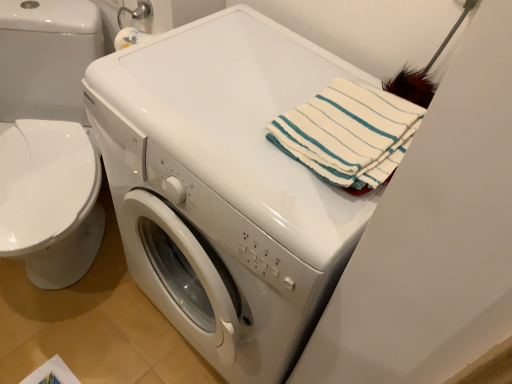
Question: Is white glossy washing machine at center positioned behind white striped towel at upper right?

Choices:
 (A) no
 (B) yes

Answer: (A)

Question: From a real-world perspective, is white glossy washing machine at center positioned under white striped towel at upper right based on gravity?

Choices:
 (A) no
 (B) yes

Answer: (B)

Question: Is white glossy washing machine at center at the left side of white striped towel at upper right?

Choices:
 (A) yes
 (B) no

Answer: (A)

Question: Is white glossy washing machine at center at the right side of white striped towel at upper right?

Choices:
 (A) yes
 (B) no

Answer: (B)

Question: Does white glossy washing machine at center have a smaller size compared to white striped towel at upper right?

Choices:
 (A) yes
 (B) no

Answer: (B)

Question: Considering their positions, is white striped towel at upper right located in front of or behind white glossy washing machine at center?

Choices:
 (A) behind
 (B) front

Answer: (A)

Question: From a real-world perspective, is white striped towel at upper right above or below white glossy washing machine at center?

Choices:
 (A) above
 (B) below

Answer: (A)

Question: Is white striped towel at upper right inside or outside of white glossy washing machine at center?

Choices:
 (A) inside
 (B) outside

Answer: (B)

Question: From the image's perspective, is white striped towel at upper right above or below white glossy washing machine at center?

Choices:
 (A) below
 (B) above

Answer: (B)

Question: Considering the positions of white glossy washer at left and white glossy washing machine at center in the image, is white glossy washer at left bigger or smaller than white glossy washing machine at center?

Choices:
 (A) small
 (B) big

Answer: (A)

Question: From the image's perspective, is white glossy washer at left positioned above or below white glossy washing machine at center?

Choices:
 (A) below
 (B) above

Answer: (B)

Question: Is point (81, 235) positioned closer to the camera than point (314, 62)?

Choices:
 (A) closer
 (B) farther

Answer: (B)

Question: From a real-world perspective, is white glossy washer at left above or below white glossy washing machine at center?

Choices:
 (A) below
 (B) above

Answer: (A)

Question: Considering the positions of white glossy washer at left and white striped towel at upper right in the image, is white glossy washer at left taller or shorter than white striped towel at upper right?

Choices:
 (A) short
 (B) tall

Answer: (B)

Question: Based on their sizes in the image, would you say white glossy washer at left is bigger or smaller than white striped towel at upper right?

Choices:
 (A) big
 (B) small

Answer: (A)